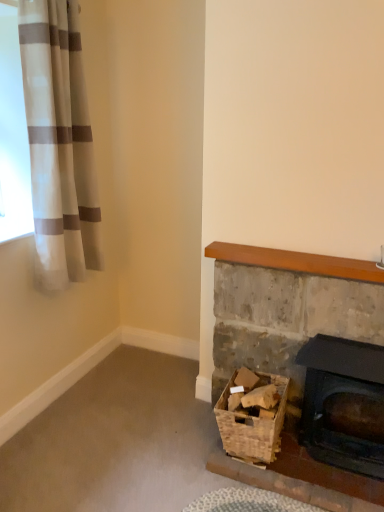
The height and width of the screenshot is (512, 384). In order to click on vacant space situated above rustic stone fireplace at lower right, which is the 1th fireplace from left to right (from a real-world perspective) in this screenshot , I will do `click(308, 272)`.